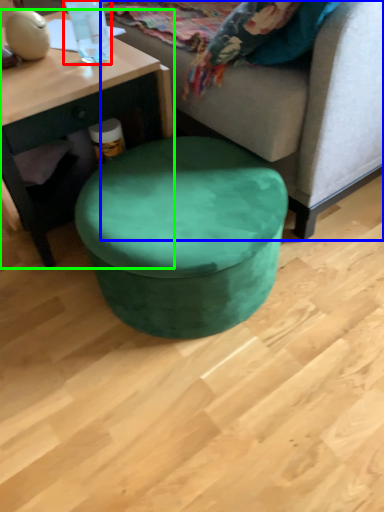
Question: Estimate the real-world distances between objects in this image. Which object is closer to bottle (highlighted by a red box), studio couch (highlighted by a blue box) or coffee table (highlighted by a green box)?

Choices:
 (A) studio couch
 (B) coffee table

Answer: (B)